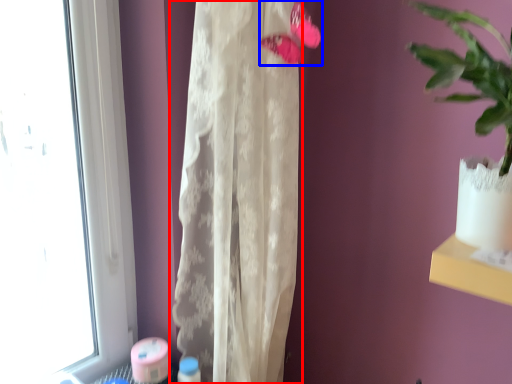
Question: Which object appears farthest to the camera in this image, curtain (highlighted by a red box) or flower (highlighted by a blue box)?

Choices:
 (A) curtain
 (B) flower

Answer: (B)